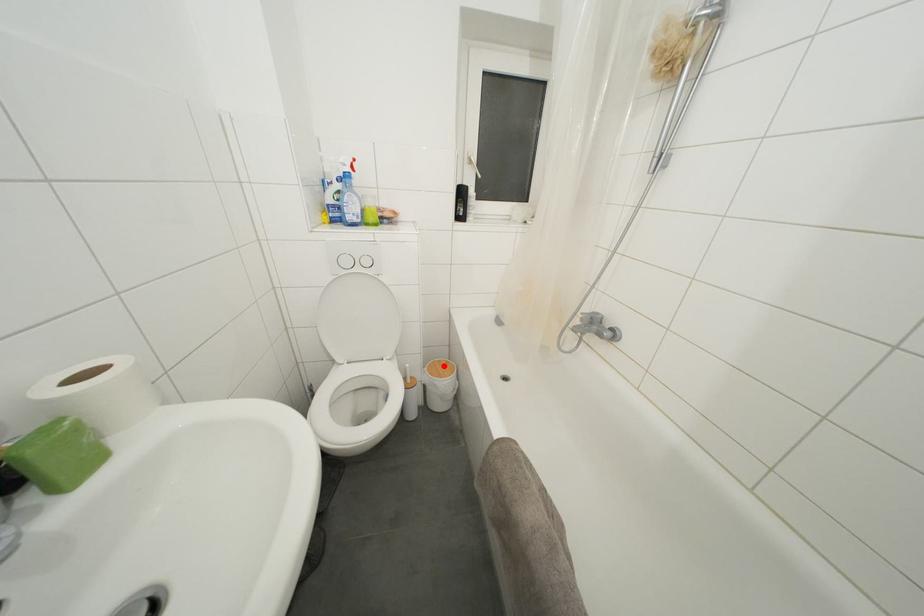
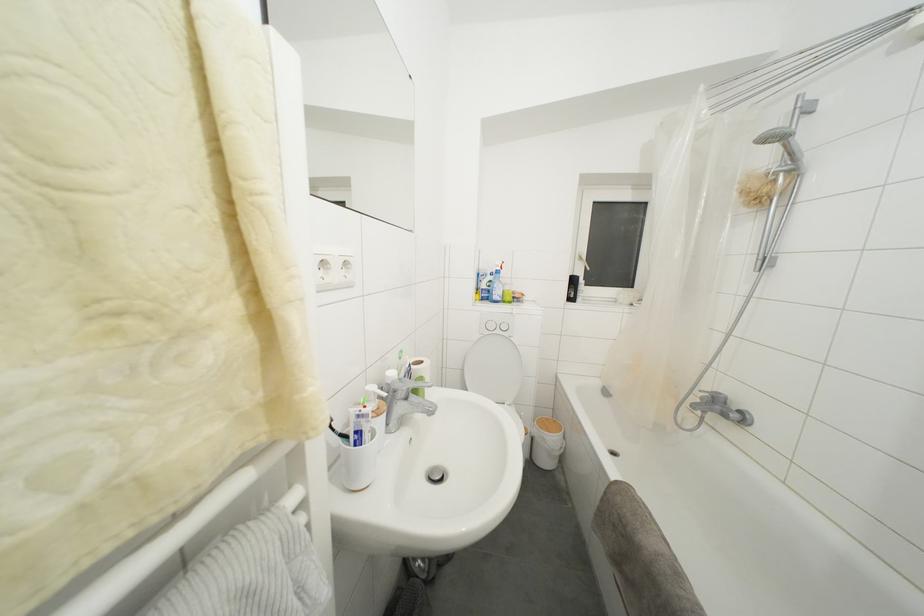
Locate, in the second image, the point that corresponds to the highlighted location in the first image.

(552, 424)